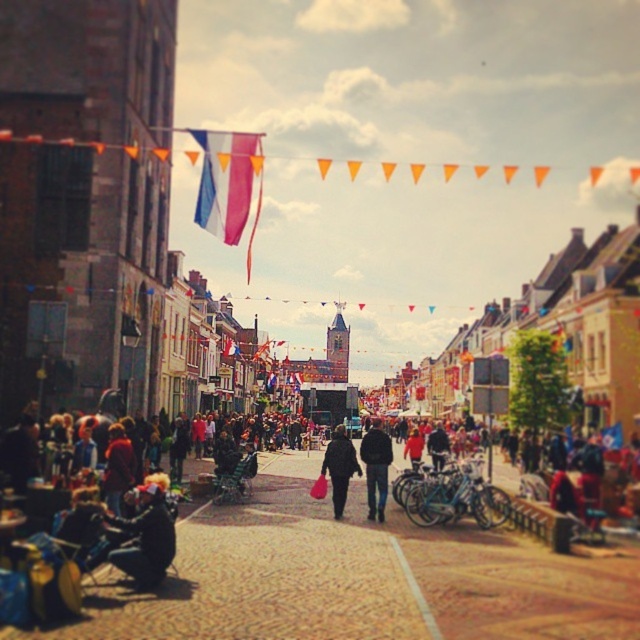
Question: Which of the following is the closest to the observer?

Choices:
 (A) matte black jacket at center
 (B) blue and white fabric flag at upper center

Answer: (A)

Question: Does dark blue jacket at lower left lie in front of matte black jacket at center?

Choices:
 (A) no
 (B) yes

Answer: (B)

Question: In this image, where is dark blue jeans at center located relative to matte black coat at center?

Choices:
 (A) above
 (B) below

Answer: (B)

Question: Among these objects, which one is nearest to the camera?

Choices:
 (A) dark blue jeans at center
 (B) dark blue jacket at lower left

Answer: (B)

Question: Which point is closer to the camera?

Choices:
 (A) (141, 577)
 (B) (419, 465)
 (C) (211, 227)
 (D) (369, 445)

Answer: (A)

Question: Considering the relative positions of dark blue jacket at lower left and matte black jacket at center in the image provided, where is dark blue jacket at lower left located with respect to matte black jacket at center?

Choices:
 (A) below
 (B) above

Answer: (B)